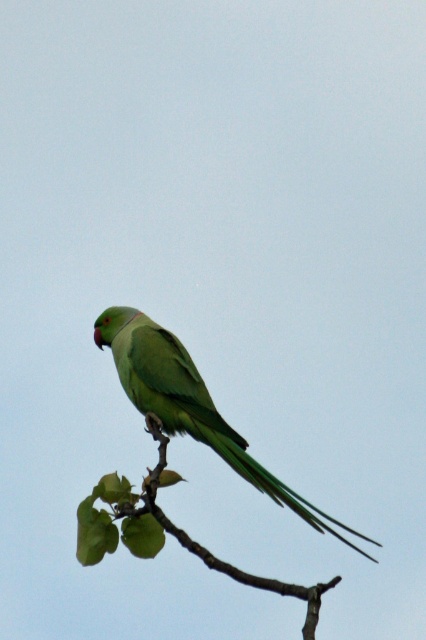
Can you confirm if green matte parrot at center is positioned above green matte tree branch at center?

Yes.

Who is more forward, (x=144, y=324) or (x=256, y=579)?

Point (x=256, y=579)

You are a GUI agent. You are given a task and a screenshot of the screen. Output one action in this format:
    pyautogui.click(x=<x>, y=<y>)
    Task: Click on the green matte parrot at center
    The width and height of the screenshot is (426, 640).
    Given the screenshot: What is the action you would take?
    pyautogui.click(x=189, y=403)

You are a GUI agent. You are given a task and a screenshot of the screen. Output one action in this format:
    pyautogui.click(x=<x>, y=<y>)
    Task: Click on the green matte parrot at center
    The height and width of the screenshot is (640, 426).
    Given the screenshot: What is the action you would take?
    pyautogui.click(x=189, y=403)